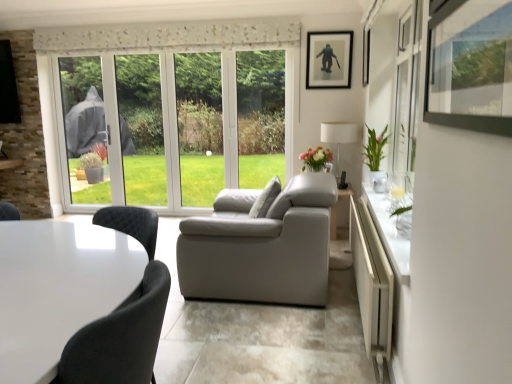
Describe the element at coordinates (58, 289) in the screenshot. I see `white glossy table at lower left` at that location.

What is the approximate width of white glossy table at lower left?

white glossy table at lower left is 24.28 inches wide.

The image size is (512, 384). What are the coordinates of `white fabric lampshade at right` in the screenshot? It's located at (339, 135).

This screenshot has height=384, width=512. I want to click on matte black picture frame at upper center, so click(x=329, y=60).

Find the location of a particular element. This screenshot has height=384, width=512. matte floral arrangement at center is located at coordinates (316, 158).

Can we say matte black picture frame at upper center lies outside matte floral arrangement at center?

That's correct, matte black picture frame at upper center is outside of matte floral arrangement at center.

Is matte black picture frame at upper center positioned with its back to matte floral arrangement at center?

matte black picture frame at upper center does not have its back to matte floral arrangement at center.

Does matte black picture frame at upper center have a larger size compared to matte floral arrangement at center?

Actually, matte black picture frame at upper center might be smaller than matte floral arrangement at center.

Does matte black picture frame at upper center have a greater height compared to matte floral arrangement at center?

Yes, matte black picture frame at upper center is taller than matte floral arrangement at center.

From the picture: Does matte floral arrangement at center turn towards matte black picture frame at upper center?

No, matte floral arrangement at center is not facing towards matte black picture frame at upper center.

Is matte floral arrangement at center behind matte black picture frame at upper center?

No, matte floral arrangement at center is closer to the viewer.

Would you say matte black picture frame at upper center is part of matte floral arrangement at center's contents?

No.

In terms of height, does matte black picture frame at upper center look taller or shorter compared to white fabric lampshade at right?

Considering their sizes, matte black picture frame at upper center has less height than white fabric lampshade at right.

In the scene shown: Is matte black picture frame at upper center inside the boundaries of white fabric lampshade at right, or outside?

matte black picture frame at upper center is outside white fabric lampshade at right.

Can you confirm if matte black picture frame at upper center is wider than white fabric lampshade at right?

Incorrect, the width of matte black picture frame at upper center does not surpass that of white fabric lampshade at right.

From a real-world perspective, is matte black picture frame at upper center positioned above or below white fabric lampshade at right?

matte black picture frame at upper center is above white fabric lampshade at right.

Is white fabric pillow at center placed right next to matte black picture frame at upper center?

white fabric pillow at center is not next to matte black picture frame at upper center, and they're not touching.

How different are the orientations of white fabric pillow at center and matte black picture frame at upper center in degrees?

They differ by 78.5 degrees in their facing directions.

In the scene shown: Is white fabric pillow at center facing away from matte black picture frame at upper center?

No, white fabric pillow at center is not facing away from matte black picture frame at upper center.

Does point (261, 199) come closer to viewer compared to point (322, 61)?

Yes, point (261, 199) is in front of point (322, 61).

Considering the sizes of objects white glossy table at lower left and matte black picture frame at upper center in the image provided, who is wider, white glossy table at lower left or matte black picture frame at upper center?

white glossy table at lower left.

Between point (67, 254) and point (326, 49), which one is positioned behind?

The point (326, 49) is more distant.

Locate an element on the screen. table in front of the matte black picture frame at upper center is located at coordinates (58, 289).

From a real-world perspective, is white glossy table at lower left positioned above or below matte black picture frame at upper center?

In terms of real-world spatial position, white glossy table at lower left is below matte black picture frame at upper center.

Considering the sizes of white glossy table at lower left and matte floral arrangement at center in the image, is white glossy table at lower left wider or thinner than matte floral arrangement at center?

Clearly, white glossy table at lower left has more width compared to matte floral arrangement at center.

Which is more to the left, white glossy table at lower left or matte floral arrangement at center?

white glossy table at lower left is more to the left.

What are the coordinates of `table on the left of matte floral arrangement at center` in the screenshot? It's located at (58, 289).

Is the position of white glossy table at lower left more distant than that of matte floral arrangement at center?

No, white glossy table at lower left is in front of matte floral arrangement at center.

From the image's perspective, between white fabric lampshade at right and matte floral arrangement at center, which one is located above?

white fabric lampshade at right is shown above in the image.

From the picture: Is white fabric lampshade at right oriented away from matte floral arrangement at center?

white fabric lampshade at right is not turned away from matte floral arrangement at center.

Where is `lamp that is on the right side of matte floral arrangement at center`? The height and width of the screenshot is (384, 512). lamp that is on the right side of matte floral arrangement at center is located at coordinates (339, 135).

Which of these two, white fabric lampshade at right or matte floral arrangement at center, is wider?

Wider between the two is white fabric lampshade at right.

Where is `flower in front of the matte black picture frame at upper center`? This screenshot has height=384, width=512. flower in front of the matte black picture frame at upper center is located at coordinates (316, 158).

Image resolution: width=512 pixels, height=384 pixels. Identify the location of picture frame above the matte floral arrangement at center (from the image's perspective). (329, 60).

Considering their positions, is white fabric pillow at center positioned closer to white fabric lampshade at right than green glossy vase at right?

The object closer to white fabric lampshade at right is green glossy vase at right.

When comparing their distances from white fabric lampshade at right, does white glossy table at lower left or green glossy vase at right seem closer?

green glossy vase at right is positioned closer to the anchor white fabric lampshade at right.

Based on their spatial positions, is matte floral arrangement at center or white fabric lampshade at right further from matte black picture frame at upper center?

matte floral arrangement at center is positioned further to the anchor matte black picture frame at upper center.

From the image, which object appears to be nearer to green glossy vase at right, white glossy table at lower left or white fabric pillow at center?

white fabric pillow at center lies closer to green glossy vase at right than the other object.

From the image, which object appears to be nearer to white fabric pillow at center, green glossy vase at right or white fabric lampshade at right?

green glossy vase at right lies closer to white fabric pillow at center than the other object.

Estimate the real-world distances between objects in this image. Which object is further from matte floral arrangement at center, green glossy vase at right or matte black picture frame at upper center?

matte black picture frame at upper center is positioned further to the anchor matte floral arrangement at center.

Looking at this image, considering their positions, is matte floral arrangement at center positioned further to white fabric pillow at center than white glossy table at lower left?

Based on the image, white glossy table at lower left appears to be further to white fabric pillow at center.

Estimate the real-world distances between objects in this image. Which object is closer to matte floral arrangement at center, matte black picture frame at upper center or green glossy vase at right?

green glossy vase at right is positioned closer to the anchor matte floral arrangement at center.

The image size is (512, 384). Find the location of `flower between green glossy vase at right and white fabric lampshade at right in the front-back direction`. flower between green glossy vase at right and white fabric lampshade at right in the front-back direction is located at coordinates (316, 158).

At what (x,y) coordinates should I click in order to perform the action: click on lamp between white fabric pillow at center and matte black picture frame at upper center in the front-back direction. Please return your answer as a coordinate pair (x, y). This screenshot has height=384, width=512. Looking at the image, I should click on tap(339, 135).

Find the location of `lamp between matte black picture frame at upper center and green glossy vase at right from top to bottom`. lamp between matte black picture frame at upper center and green glossy vase at right from top to bottom is located at coordinates (339, 135).

The image size is (512, 384). In order to click on flower between white fabric pillow at center and green glossy vase at right from left to right in this screenshot , I will do `click(316, 158)`.